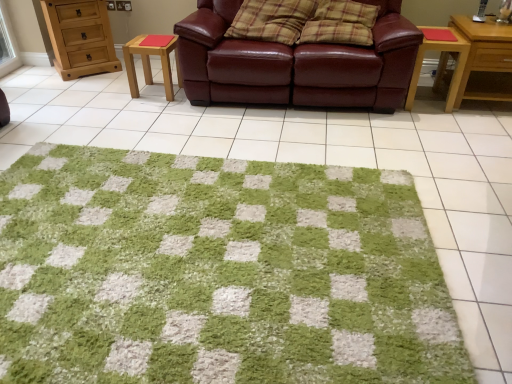
Locate an element on the screen. free spot below wooden side table at right, which is the first table in right-to-left order (from a real-world perspective) is located at coordinates (428, 98).